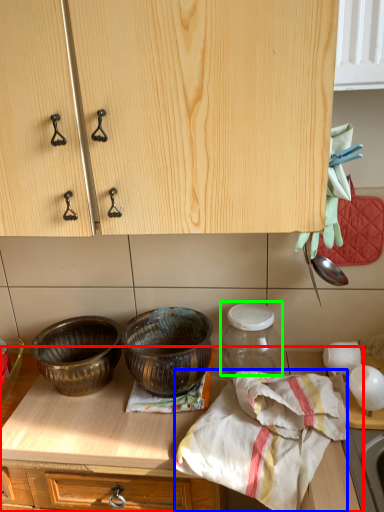
Question: Based on their relative distances, which object is nearer to countertop (highlighted by a red box)? Choose from blanket (highlighted by a blue box) and glass jar (highlighted by a green box).

Choices:
 (A) blanket
 (B) glass jar

Answer: (A)